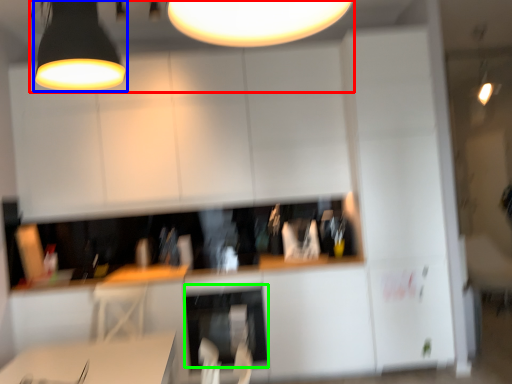
Question: Which object is the farthest from lamp (highlighted by a red box)? Choose among these: lamp (highlighted by a blue box) or dish washer (highlighted by a green box).

Choices:
 (A) lamp
 (B) dish washer

Answer: (B)